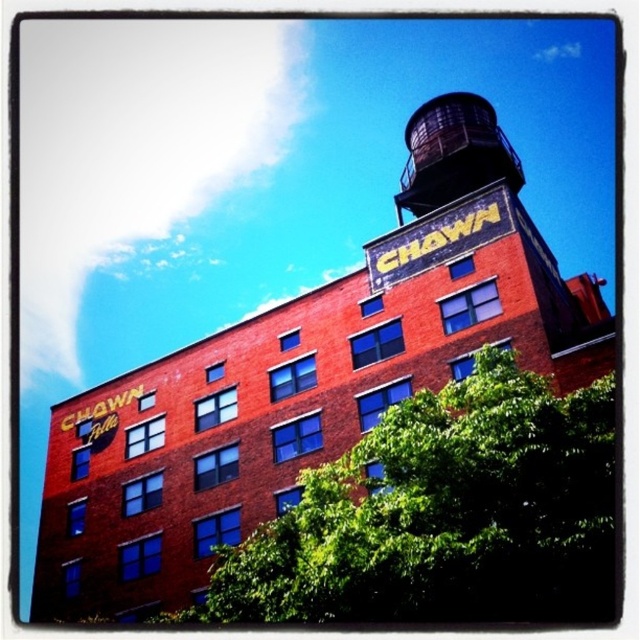
Question: Can you confirm if green leafy tree at lower center is positioned to the right of dark brown metal water tower at upper center?

Choices:
 (A) no
 (B) yes

Answer: (A)

Question: Which point appears closest to the camera in this image?

Choices:
 (A) (433, 189)
 (B) (387, 576)

Answer: (B)

Question: Does green leafy tree at lower center appear under dark brown metal water tower at upper center?

Choices:
 (A) yes
 (B) no

Answer: (A)

Question: Is green leafy tree at lower center wider than dark brown metal water tower at upper center?

Choices:
 (A) no
 (B) yes

Answer: (B)